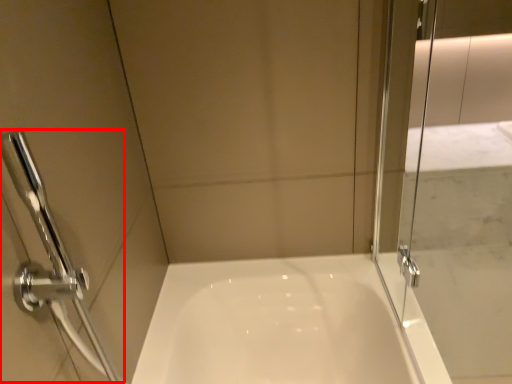
Question: In this image, where is shower (annotated by the red box) located relative to screen door?

Choices:
 (A) right
 (B) left

Answer: (B)